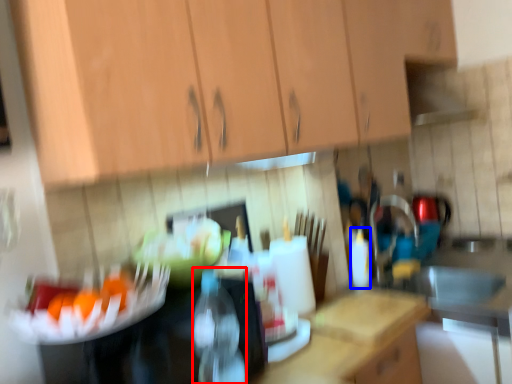
Question: Which object appears closest to the camera in this image, bottle (highlighted by a red box) or bottle (highlighted by a blue box)?

Choices:
 (A) bottle
 (B) bottle

Answer: (A)